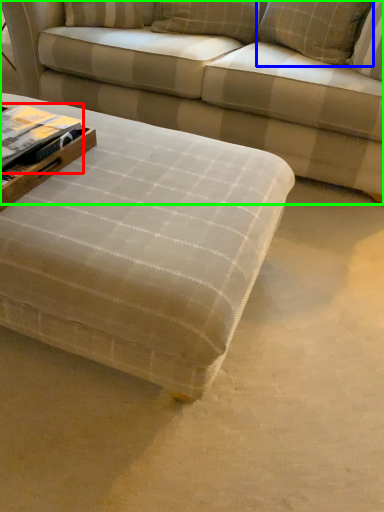
Question: Based on their relative distances, which object is nearer to book (highlighted by a red box)? Choose from pillow (highlighted by a blue box) and studio couch (highlighted by a green box).

Choices:
 (A) pillow
 (B) studio couch

Answer: (B)